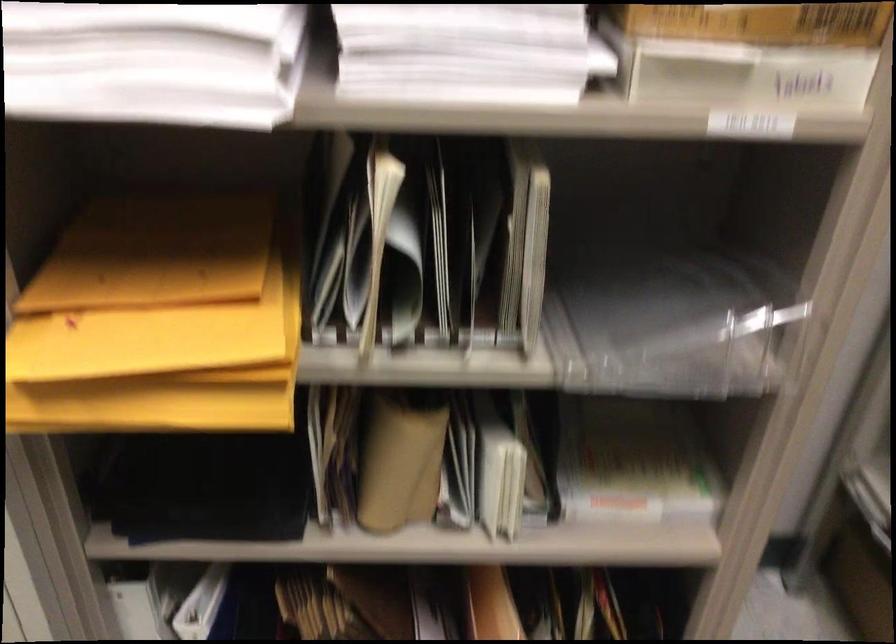
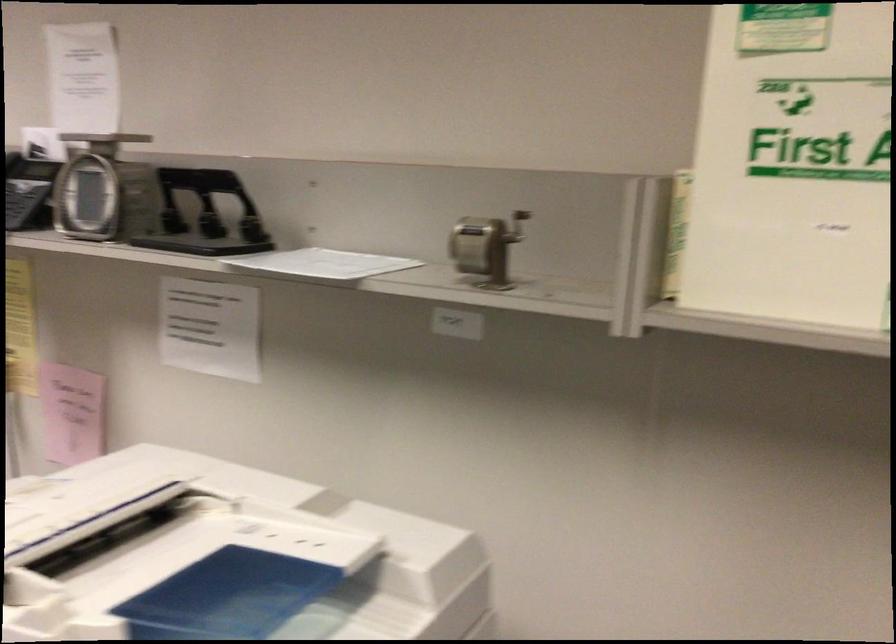
Question: Which direction would the cameraman need to move to produce the second image? Reply with the corresponding letter.

Choices:
 (A) Left
 (B) Right
 (C) Forward
 (D) Backward

Answer: (D)